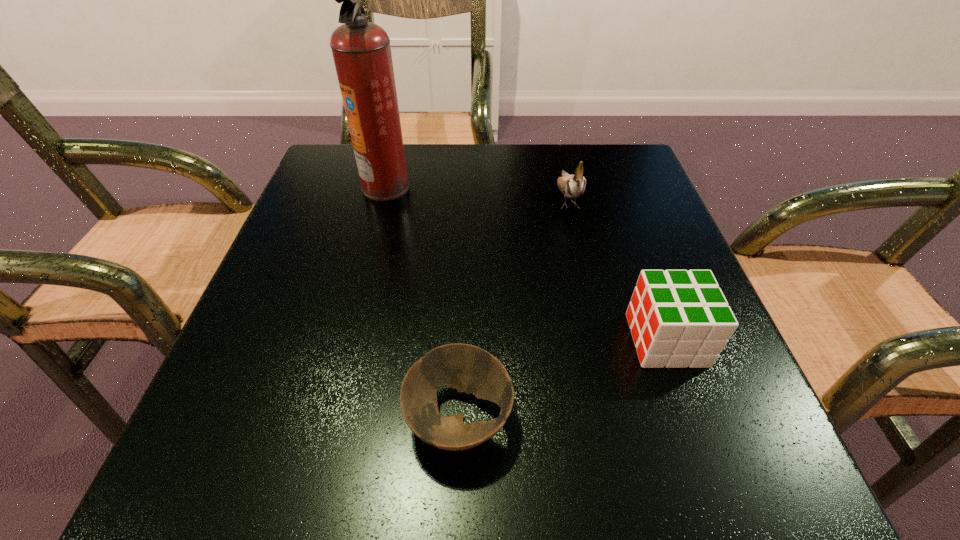
You are a GUI agent. You are given a task and a screenshot of the screen. Output one action in this format:
    pyautogui.click(x=<x>, y=<y>)
    Task: Click on the free area in between the third farthest object and the tallest object
    The image size is (960, 540).
    Given the screenshot: What is the action you would take?
    pyautogui.click(x=526, y=263)

Where is `free spot between the bowl and the bird`? The image size is (960, 540). free spot between the bowl and the bird is located at coordinates (514, 307).

Where is `vacant region between the shortest object and the third object from left to right`? This screenshot has height=540, width=960. vacant region between the shortest object and the third object from left to right is located at coordinates (514, 307).

Find the location of a particular element. unoccupied area between the second shortest object and the nearest object is located at coordinates (563, 379).

In order to click on empty space that is in between the bowl and the second shortest object in this screenshot , I will do (563, 379).

Identify the location of unoccupied position between the leftmost object and the third farthest object. (526, 263).

Locate an element on the screen. This screenshot has width=960, height=540. free space between the second tallest object and the bowl is located at coordinates coord(514,307).

At what (x,y) coordinates should I click in order to perform the action: click on empty location between the third object from right to left and the leftmost object. Please return your answer as a coordinate pair (x, y). The width and height of the screenshot is (960, 540). Looking at the image, I should click on (422, 302).

The width and height of the screenshot is (960, 540). What are the coordinates of `vacant area that lies between the rightmost object and the fire extinguisher` in the screenshot? It's located at (526, 263).

The image size is (960, 540). In order to click on the closest object relative to the second tallest object in this screenshot , I will do `click(678, 318)`.